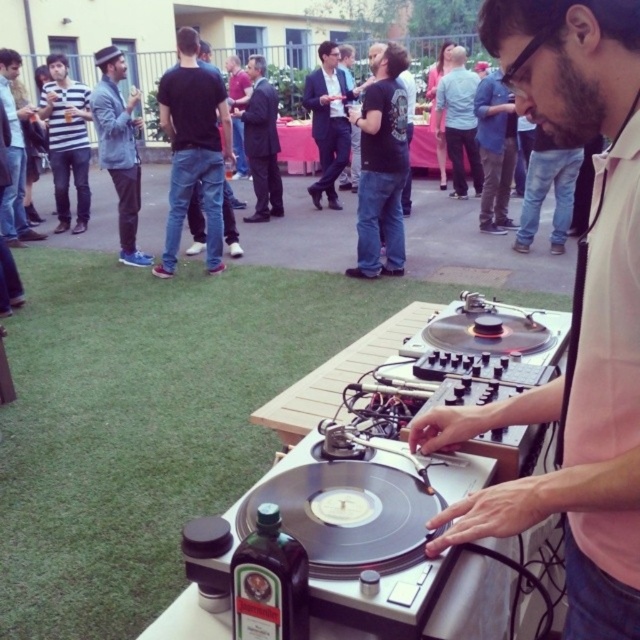
Between point (616, 628) and point (497, 86), which one is positioned behind?

Positioned behind is point (497, 86).

Is pink matte shirt at center to the left of pink shirt at center from the viewer's perspective?

Yes, pink matte shirt at center is to the left of pink shirt at center.

Is point (547, 496) closer to camera compared to point (500, 202)?

Yes, it is in front of point (500, 202).

In order to click on pink matte shirt at center in this screenshot , I will do `click(579, 316)`.

Measure the distance between point (568, 557) and camera.

Point (568, 557) is 96.71 centimeters away from camera.

Who is more forward, (598, 0) or (221, 192)?

Positioned in front is point (598, 0).

Is point (541, 13) positioned in front of point (168, 241)?

Yes.

Locate an element on the screen. Image resolution: width=640 pixels, height=640 pixels. pink matte shirt at center is located at coordinates (579, 316).

Who is higher up, pink matte shirt at center or denim jacket at upper left?

denim jacket at upper left is above.

Does pink matte shirt at center have a greater height compared to denim jacket at upper left?

No.

Who is more forward, (x=600, y=592) or (x=131, y=173)?

Point (x=600, y=592) is in front.

The height and width of the screenshot is (640, 640). I want to click on pink matte shirt at center, so [579, 316].